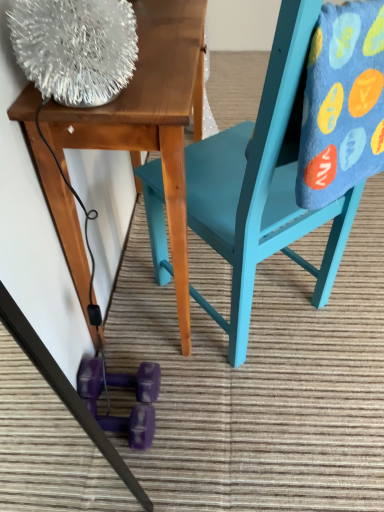
You are a GUI agent. You are given a task and a screenshot of the screen. Output one action in this format:
    pyautogui.click(x=<x>, y=<y>)
    Task: Click on the free space in front of teal painted wood chair at center
    The image size is (384, 512).
    Given the screenshot: What is the action you would take?
    pyautogui.click(x=263, y=424)